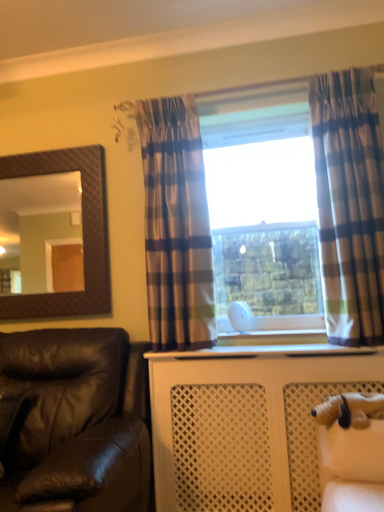
Question: Which direction should I rotate to look at plaid fabric curtain at center, marked as the second curtain in a right-to-left arrangement, — up or down?

Choices:
 (A) down
 (B) up

Answer: (B)

Question: Can you confirm if white plush dog at lower right is bigger than brown textured mirror at upper left?

Choices:
 (A) no
 (B) yes

Answer: (A)

Question: From a real-world perspective, is white plush dog at lower right over brown textured mirror at upper left?

Choices:
 (A) no
 (B) yes

Answer: (A)

Question: From the image's perspective, is white plush dog at lower right over brown textured mirror at upper left?

Choices:
 (A) yes
 (B) no

Answer: (B)

Question: From a real-world perspective, is white plush dog at lower right below brown textured mirror at upper left?

Choices:
 (A) no
 (B) yes

Answer: (B)

Question: From the image's perspective, is white plush dog at lower right beneath brown textured mirror at upper left?

Choices:
 (A) no
 (B) yes

Answer: (B)

Question: Considering the relative positions of white plush dog at lower right and brown textured mirror at upper left in the image provided, is white plush dog at lower right to the right of brown textured mirror at upper left from the viewer's perspective?

Choices:
 (A) yes
 (B) no

Answer: (A)

Question: Can you confirm if plaid fabric curtain at right, marked as the second curtain in a left-to-right arrangement, is bigger than brown textured mirror at upper left?

Choices:
 (A) yes
 (B) no

Answer: (A)

Question: Is plaid fabric curtain at right, marked as the second curtain in a left-to-right arrangement, turned away from brown textured mirror at upper left?

Choices:
 (A) yes
 (B) no

Answer: (B)

Question: Is plaid fabric curtain at right, arranged as the 1th curtain when viewed from the right, wider than brown textured mirror at upper left?

Choices:
 (A) no
 (B) yes

Answer: (B)

Question: Is plaid fabric curtain at right, marked as the second curtain in a left-to-right arrangement, at the left side of brown textured mirror at upper left?

Choices:
 (A) yes
 (B) no

Answer: (B)

Question: Does plaid fabric curtain at right, marked as the second curtain in a left-to-right arrangement, have a smaller size compared to brown textured mirror at upper left?

Choices:
 (A) no
 (B) yes

Answer: (A)

Question: Does plaid fabric curtain at right, marked as the second curtain in a left-to-right arrangement, turn towards brown textured mirror at upper left?

Choices:
 (A) no
 (B) yes

Answer: (A)

Question: From a real-world perspective, is brown textured mirror at upper left on plaid fabric curtain at right, marked as the second curtain in a left-to-right arrangement?

Choices:
 (A) yes
 (B) no

Answer: (A)